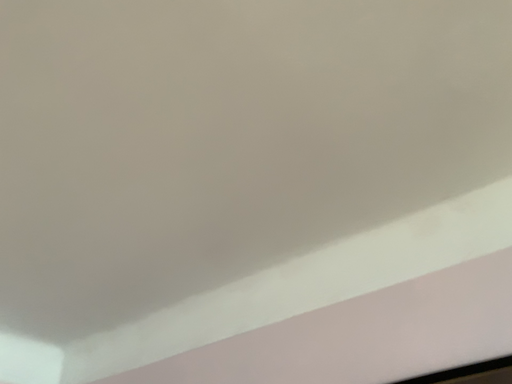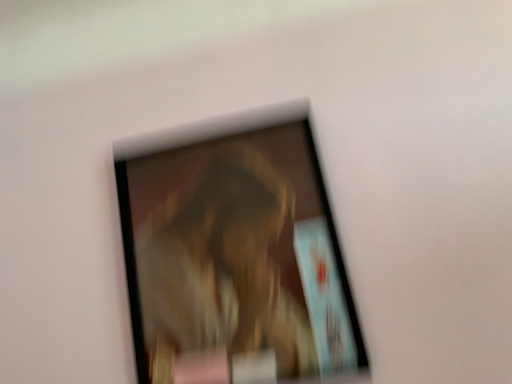
Question: Which way did the camera rotate in the video?

Choices:
 (A) rotated left
 (B) rotated right

Answer: (B)